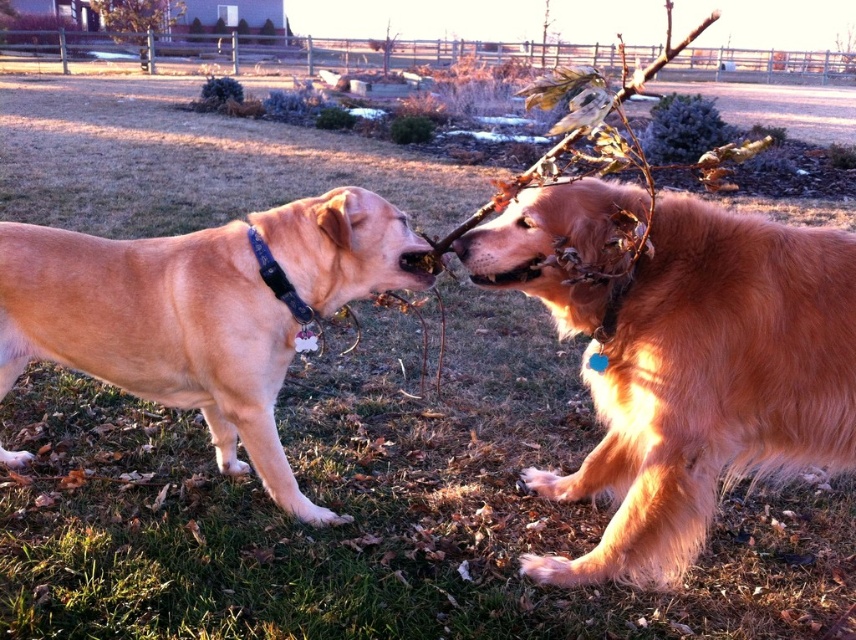
Who is positioned more to the right, golden fur dog at right or golden fur dog at left?

Positioned to the right is golden fur dog at right.

Does golden fur dog at right appear over golden fur dog at left?

No.

The width and height of the screenshot is (856, 640). I want to click on golden fur dog at right, so click(710, 385).

The image size is (856, 640). I want to click on golden fur dog at right, so click(710, 385).

Who is lower down, brown textured branch at center or fuzzy golden fur at center?

Positioned lower is fuzzy golden fur at center.

Which is in front, point (704, 20) or point (492, 280)?

Point (704, 20) is more forward.

I want to click on brown textured branch at center, so [498, 196].

Is point (708, 468) less distant than point (569, 132)?

No.

Can you confirm if golden fur dog at right is smaller than brown textured branch at center?

Yes.

Which is in front, point (539, 221) or point (440, 248)?

Positioned in front is point (539, 221).

Image resolution: width=856 pixels, height=640 pixels. Find the location of `golden fur dog at right`. golden fur dog at right is located at coordinates (710, 385).